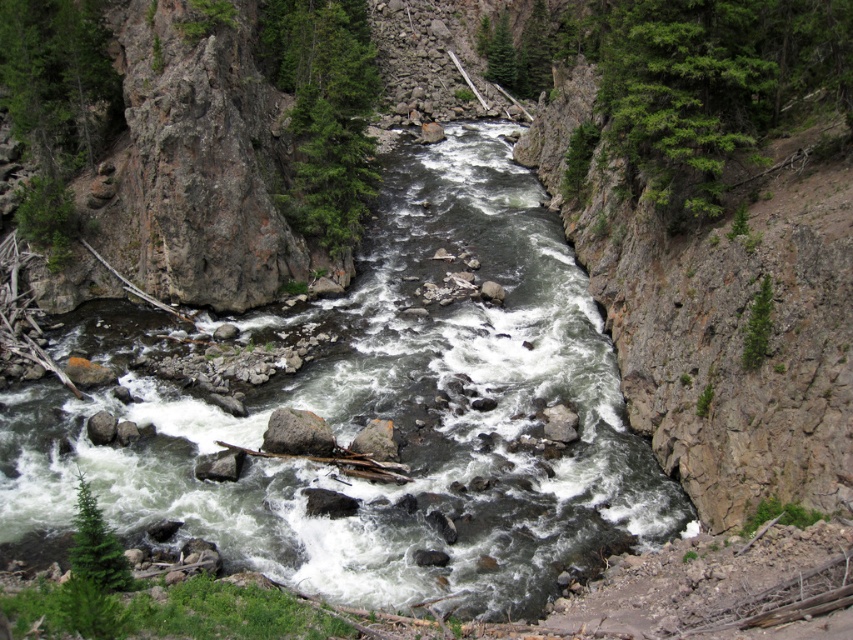
You are a hiker who wants to cross the river using a fallen log bridge. You notice the green textured tree at upper center and the gray rock at lower left. Which object would provide a more stable footing if you need to step on them?

The green textured tree at upper center has a larger size compared to the gray rock at lower left, so stepping on it would provide a more stable footing.

You are a hiker standing at the point marked by point (96, 545). You want to cross the river to reach the green matte tree at lower left. Is the river at this location shallow enough for safe crossing?

The point (96, 545) marks the green matte tree at lower left, so you are already at the tree. There is no need to cross the river here.

You are standing at the edge of the river and notice a green matte tree at lower left and a gray rock at lower left. Which object is positioned more to the left?

The gray rock at lower left is positioned more to the left since the green matte tree at lower left is to the right of it.